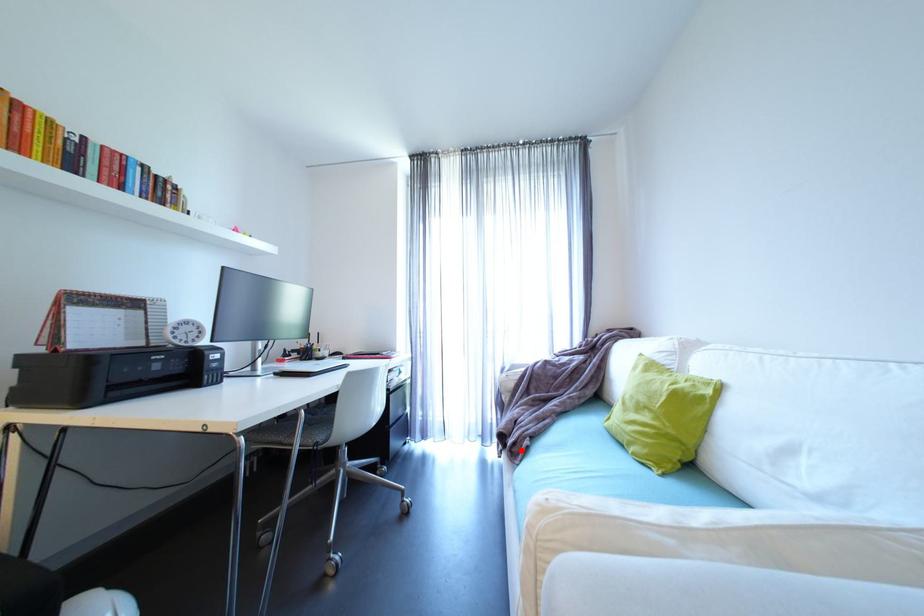
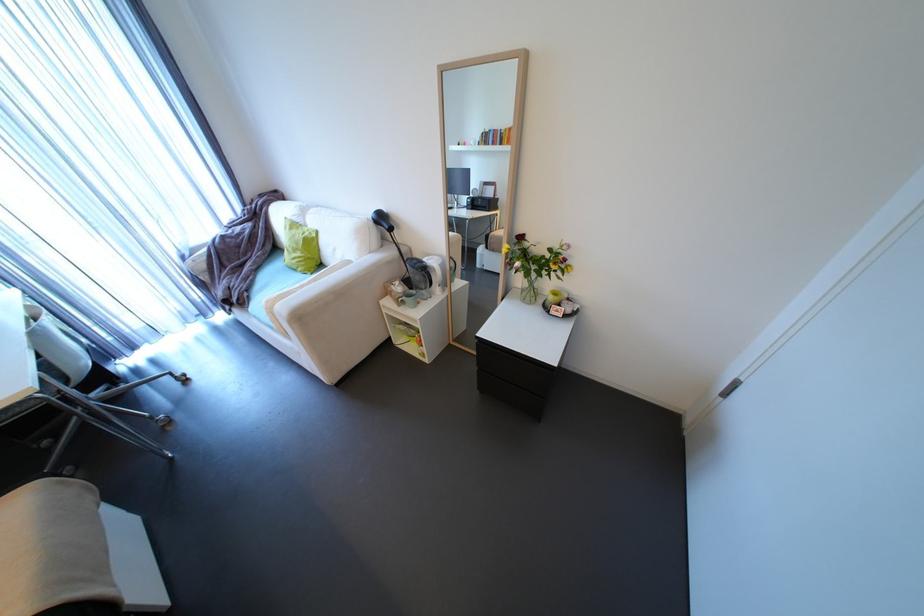
Question: I am providing you with two images of the same scene from different viewpoints. In image1, a red point is highlighted. Considering the same 3D point in image2, which of the following is correct?

Choices:
 (A) It is closer
 (B) It is farther

Answer: (B)